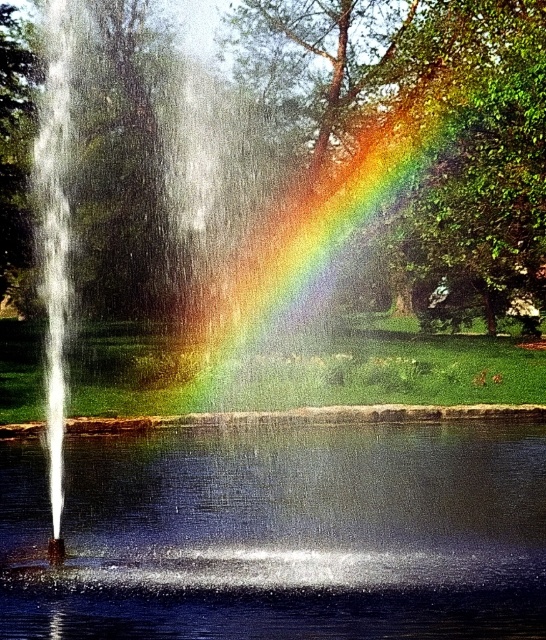
Question: Is transparent glass lake at center to the right of rainbow at center from the viewer's perspective?

Choices:
 (A) yes
 (B) no

Answer: (B)

Question: Is transparent glass lake at center to the left of rainbow at center from the viewer's perspective?

Choices:
 (A) no
 (B) yes

Answer: (B)

Question: Does transparent glass lake at center lie in front of rainbow at center?

Choices:
 (A) no
 (B) yes

Answer: (B)

Question: Which point appears closest to the camera in this image?

Choices:
 (A) (314, 259)
 (B) (10, 620)

Answer: (B)

Question: Which of the following is the closest to the observer?

Choices:
 (A) (361, 188)
 (B) (287, 496)

Answer: (B)

Question: Which point is farther to the camera?

Choices:
 (A) transparent glass lake at center
 (B) rainbow at center

Answer: (B)